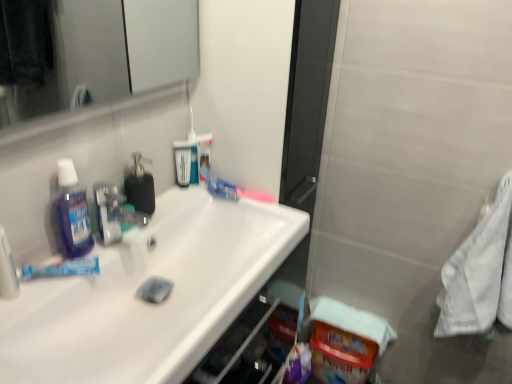
You are a GUI agent. You are given a task and a screenshot of the screen. Output one action in this format:
    pyautogui.click(x=<x>, y=<y>)
    Task: Click on the vacant area to the right of blue glossy mouthwash at upper center, the 2th mouthwash viewed from the right
    Image resolution: width=512 pixels, height=384 pixels.
    Given the screenshot: What is the action you would take?
    pyautogui.click(x=223, y=196)